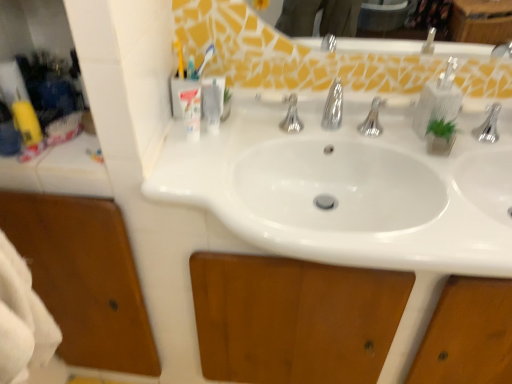
Question: Which direction should I rotate to look at clear plastic soap dispenser at upper center, placed as the first toiletry when sorted from right to left?

Choices:
 (A) left
 (B) right

Answer: (A)

Question: Is the position of clear plastic soap dispenser at upper center, the 2th toiletry positioned from the left, more distant than that of clear plastic soap dispenser at upper right?

Choices:
 (A) yes
 (B) no

Answer: (A)

Question: From the image's perspective, is clear plastic soap dispenser at upper center, placed as the first toiletry when sorted from right to left, below clear plastic soap dispenser at upper right?

Choices:
 (A) yes
 (B) no

Answer: (A)

Question: From the image's perspective, is clear plastic soap dispenser at upper center, the 2th toiletry positioned from the left, located above clear plastic soap dispenser at upper right?

Choices:
 (A) no
 (B) yes

Answer: (A)

Question: Is clear plastic soap dispenser at upper center, placed as the first toiletry when sorted from right to left, smaller than clear plastic soap dispenser at upper right?

Choices:
 (A) yes
 (B) no

Answer: (A)

Question: From a real-world perspective, is clear plastic soap dispenser at upper center, the 2th toiletry positioned from the left, positioned over clear plastic soap dispenser at upper right based on gravity?

Choices:
 (A) no
 (B) yes

Answer: (A)

Question: Considering the relative positions of clear plastic soap dispenser at upper center, placed as the first toiletry when sorted from right to left, and clear plastic soap dispenser at upper right in the image provided, is clear plastic soap dispenser at upper center, placed as the first toiletry when sorted from right to left, to the right of clear plastic soap dispenser at upper right from the viewer's perspective?

Choices:
 (A) no
 (B) yes

Answer: (A)

Question: Considering the relative sizes of translucent plastic toothbrush at upper center and translucent plastic toothbrush holder at upper left, the 1th toiletry viewed from the left, in the image provided, is translucent plastic toothbrush at upper center bigger than translucent plastic toothbrush holder at upper left, the 1th toiletry viewed from the left,?

Choices:
 (A) yes
 (B) no

Answer: (B)

Question: Is translucent plastic toothbrush at upper center behind translucent plastic toothbrush holder at upper left, the 1th toiletry viewed from the left?

Choices:
 (A) yes
 (B) no

Answer: (A)

Question: Considering the relative positions of translucent plastic toothbrush at upper center and translucent plastic toothbrush holder at upper left, the 1th toiletry viewed from the left, in the image provided, is translucent plastic toothbrush at upper center to the right of translucent plastic toothbrush holder at upper left, the 1th toiletry viewed from the left, from the viewer's perspective?

Choices:
 (A) no
 (B) yes

Answer: (B)

Question: Is translucent plastic toothbrush at upper center aimed at translucent plastic toothbrush holder at upper left, the 1th toiletry viewed from the left?

Choices:
 (A) yes
 (B) no

Answer: (A)

Question: Is translucent plastic toothbrush at upper center thinner than translucent plastic toothbrush holder at upper left, acting as the second toiletry starting from the right?

Choices:
 (A) yes
 (B) no

Answer: (A)

Question: From the image's perspective, is translucent plastic toothbrush at upper center on top of translucent plastic toothbrush holder at upper left, the 1th toiletry viewed from the left?

Choices:
 (A) yes
 (B) no

Answer: (A)

Question: Considering the relative sizes of translucent plastic toothbrush holder at upper left, the 1th toiletry viewed from the left, and clear plastic soap dispenser at upper center, the 2th toiletry positioned from the left, in the image provided, is translucent plastic toothbrush holder at upper left, the 1th toiletry viewed from the left, wider than clear plastic soap dispenser at upper center, the 2th toiletry positioned from the left,?

Choices:
 (A) yes
 (B) no

Answer: (A)